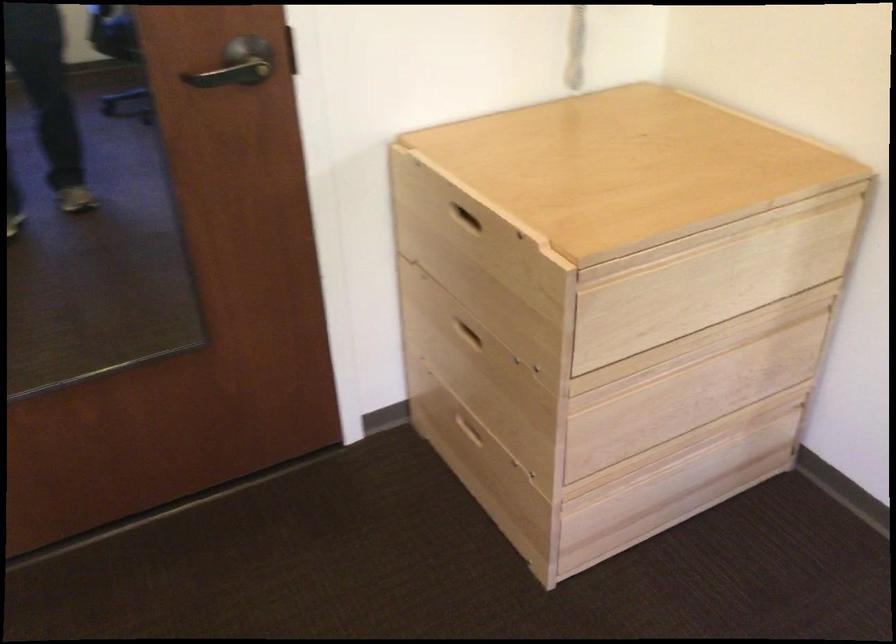
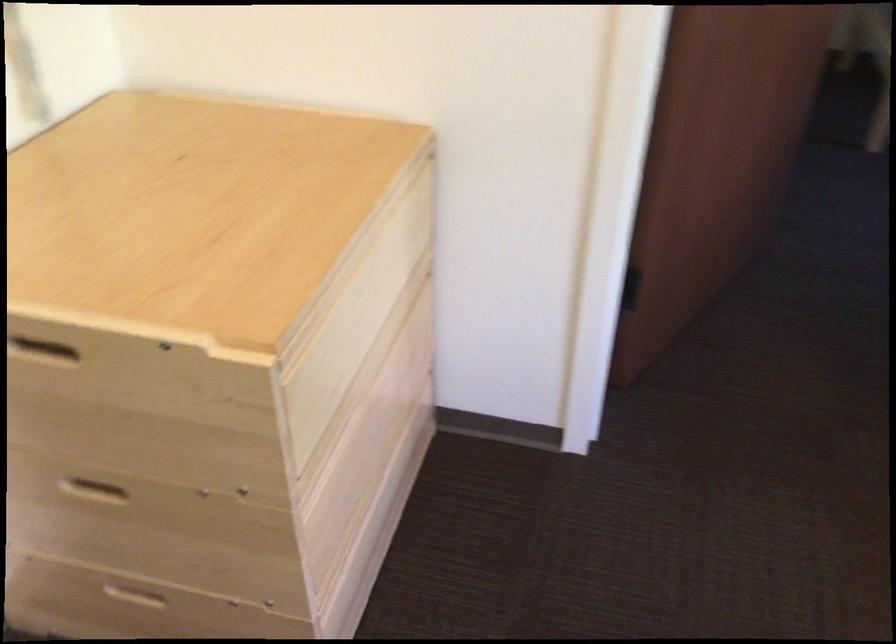
In the second image, find the point that corresponds to pixel 464 332 in the first image.

(90, 488)